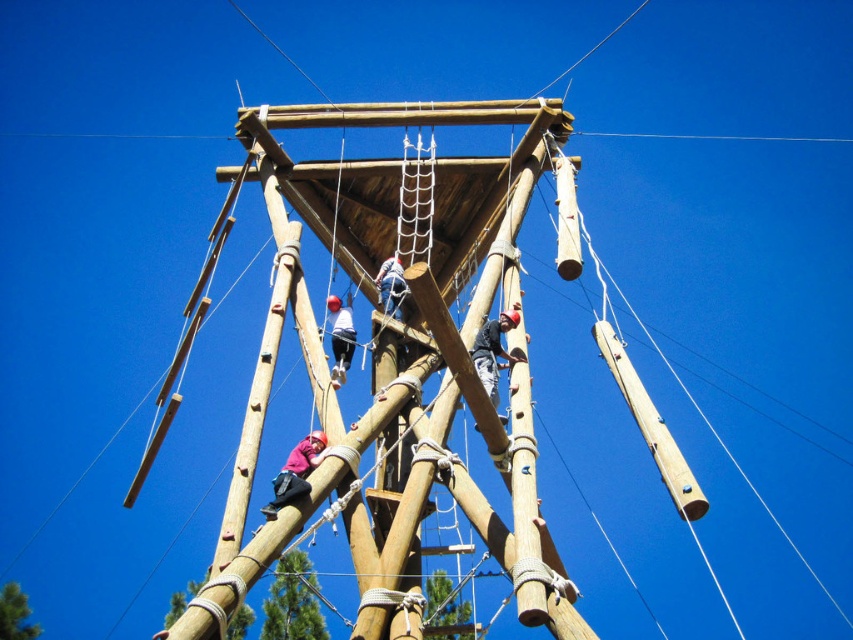
Does point (273, 506) come in front of point (392, 257)?

Yes.

Looking at this image, is pink fabric at center closer to the viewer compared to blue fabric climbing harness at center?

Yes, it is in front of blue fabric climbing harness at center.

Is point (288, 470) closer to viewer compared to point (383, 294)?

Yes.

Where is `pink fabric at center`? The height and width of the screenshot is (640, 853). pink fabric at center is located at coordinates point(296,472).

Who is positioned more to the right, white fabric helmet at center or blue fabric climbing harness at center?

From the viewer's perspective, blue fabric climbing harness at center appears more on the right side.

At what (x,y) coordinates should I click in order to perform the action: click on white fabric helmet at center. Please return your answer as a coordinate pair (x, y). Looking at the image, I should click on (340, 337).

Locate an element on the screen. This screenshot has width=853, height=640. white fabric helmet at center is located at coordinates (340, 337).

Does point (498, 346) lie in front of point (393, 298)?

Yes, it is in front of point (393, 298).

Which is in front, point (503, 326) or point (399, 273)?

Point (503, 326)

I want to click on dark gray fabric climbing harness at center, so click(x=492, y=352).